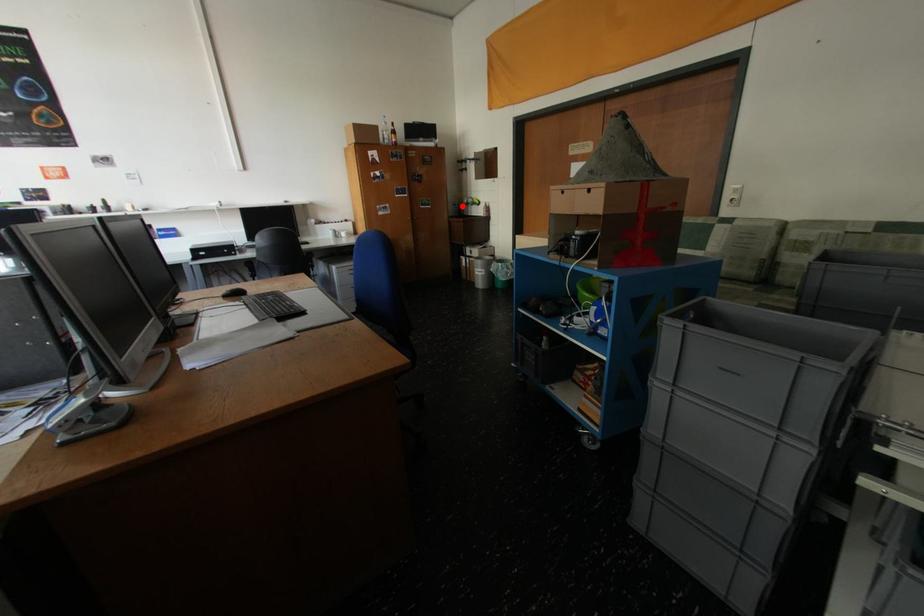
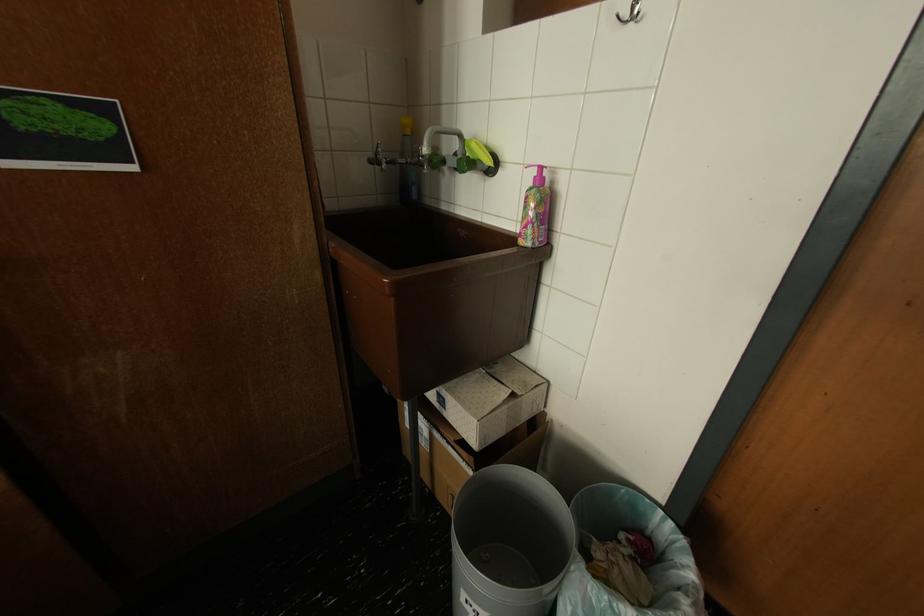
Where in the second image is the point corresponding to the highlighted location from the first image?

(379, 163)